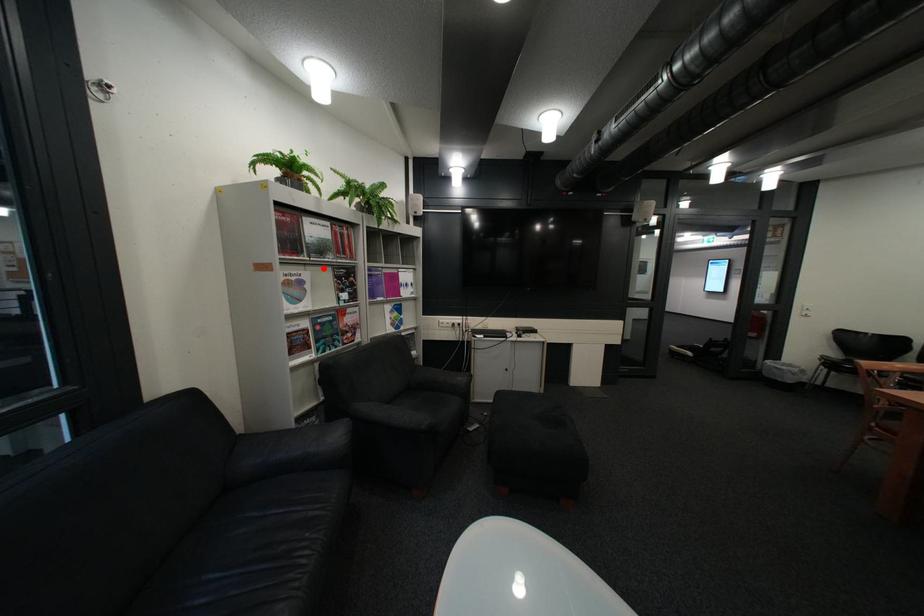
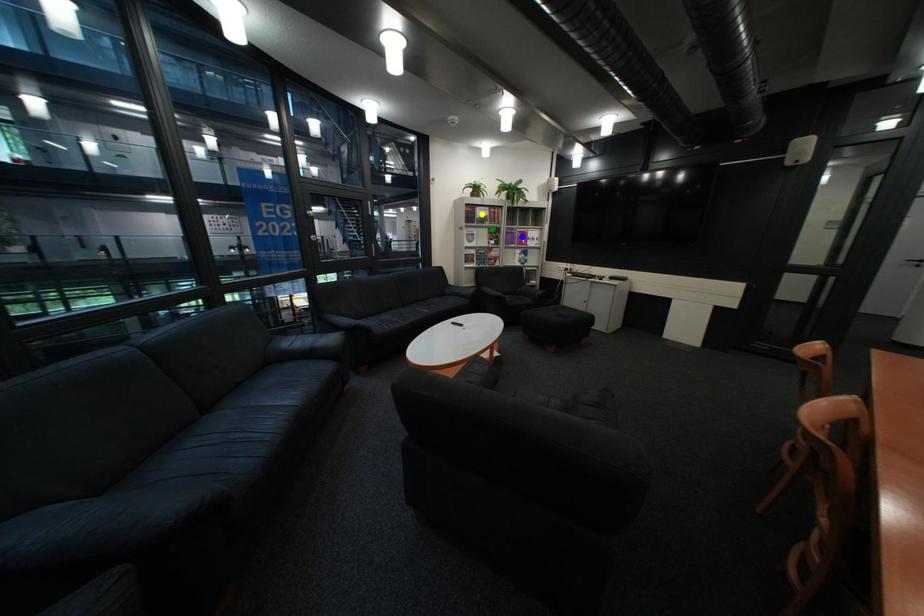
Question: I am providing you with two images of the same scene from different viewpoints. A red point is marked on the first image. You are given multiple points on the second image. Which point in image 2 is actually the same real-world point as the red point in image 1?

Choices:
 (A) yellow point
 (B) blue point
 (C) green point

Answer: (C)